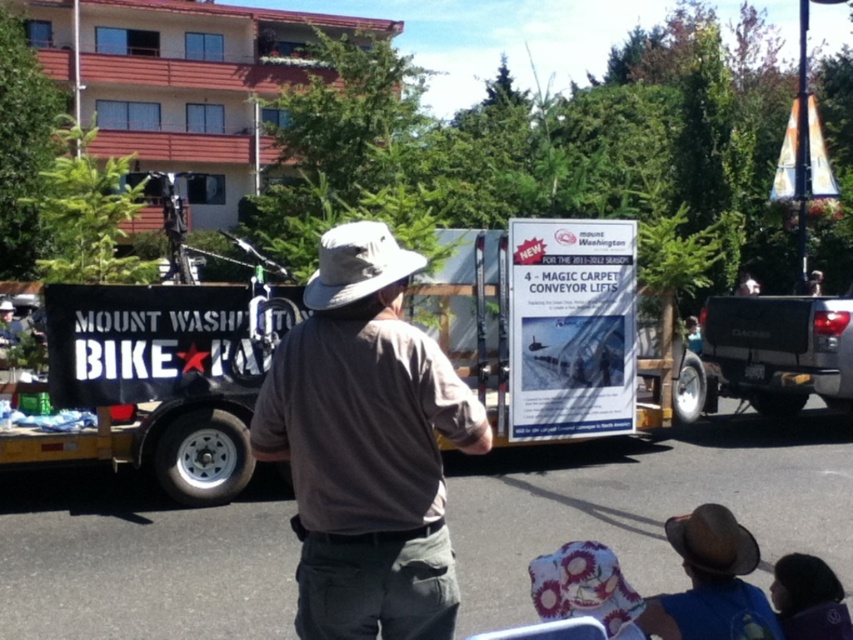
Question: Does black matte trailer at center appear over matte black truck at right?

Choices:
 (A) no
 (B) yes

Answer: (A)

Question: Based on their relative distances, which object is nearer to the light gray fabric cowboy hat at center?

Choices:
 (A) brown cotton shirt at center
 (B) black matte trailer at center
 (C) matte black truck at right

Answer: (A)

Question: Which point is farther to the camera?

Choices:
 (A) (73, 403)
 (B) (335, 321)

Answer: (A)

Question: Can you confirm if black matte trailer at center is positioned to the right of brown felt cowboy hat at lower center?

Choices:
 (A) yes
 (B) no

Answer: (B)

Question: Observing the image, what is the correct spatial positioning of brown cotton shirt at center in reference to light gray fabric cowboy hat at center?

Choices:
 (A) right
 (B) left

Answer: (A)

Question: Estimate the real-world distances between objects in this image. Which object is closer to the black matte trailer at center?

Choices:
 (A) matte black truck at right
 (B) brown cotton shirt at center

Answer: (B)